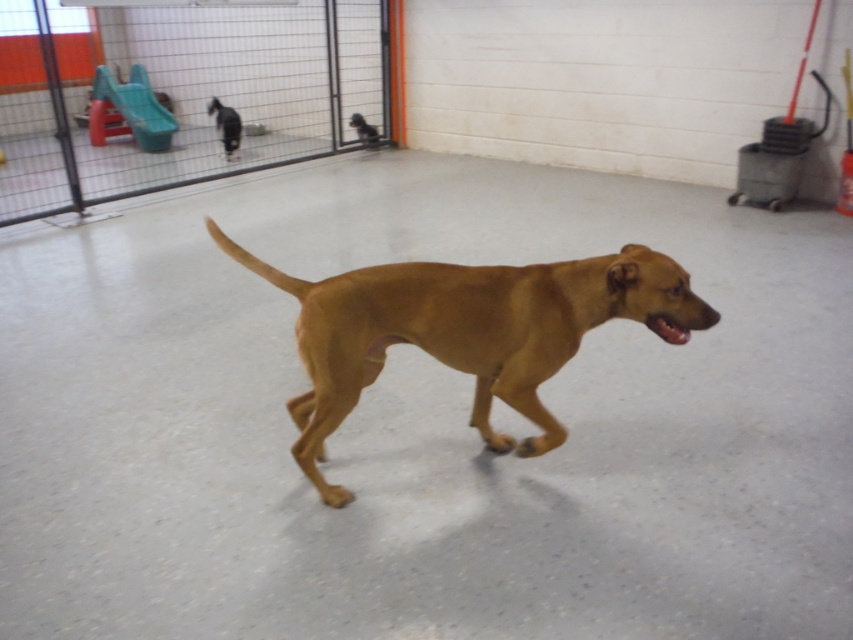
You are a caretaker in the kennel and need to check the wire mesh fence at upper left and the shiny black dog at upper left. Which object is wider?

The wire mesh fence at upper left is wider than the shiny black dog at upper left according to the description.

You are a visitor at the kennel and want to pet the golden brown fur at center and the shiny black dog at upper left. Based on their positions in the image, which one is closer to you?

The golden brown fur at center is closer to you because it is in front of the shiny black dog at upper left.